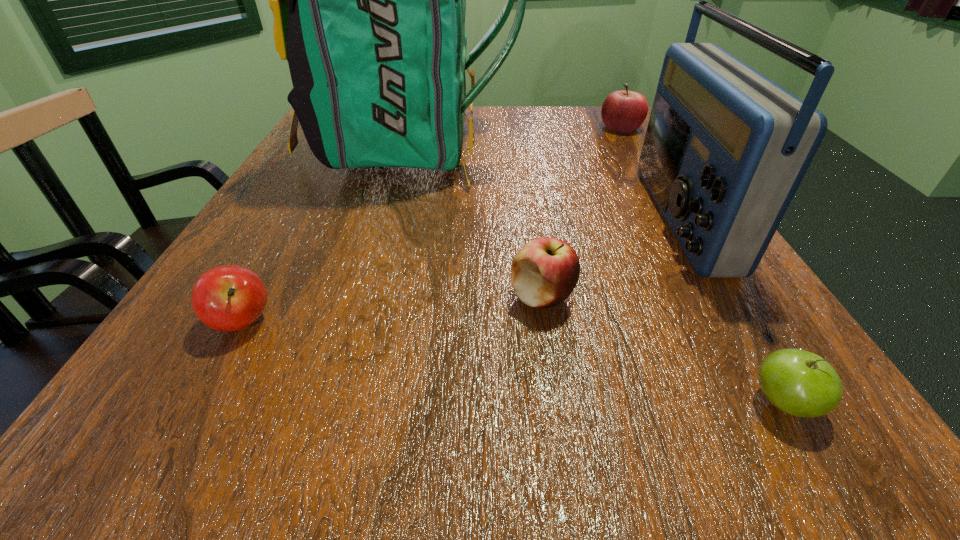
You are a GUI agent. You are given a task and a screenshot of the screen. Output one action in this format:
    pyautogui.click(x=<x>, y=<y>)
    Task: Click on the tallest object
    
    Given the screenshot: What is the action you would take?
    pyautogui.click(x=369, y=0)

This screenshot has width=960, height=540. I want to click on radio receiver, so click(726, 148).

The image size is (960, 540). Identify the location of the farthest apple. (624, 111).

Identify the location of the second apple from left to right. (544, 272).

Identify the location of the leftmost apple. The image size is (960, 540). (227, 298).

Where is `the nearest object`? the nearest object is located at coordinates (800, 383).

Where is `vacant area situated on the back of the tallest object`? Image resolution: width=960 pixels, height=540 pixels. vacant area situated on the back of the tallest object is located at coordinates (619, 145).

This screenshot has height=540, width=960. In order to click on vacant point located on the front panel of the second tallest object in this screenshot , I will do `click(623, 217)`.

The width and height of the screenshot is (960, 540). I want to click on free space located 0.390m on the front panel of the second tallest object, so click(x=431, y=217).

At what (x,y) coordinates should I click in order to perform the action: click on free space located 0.280m on the front panel of the second tallest object. Please return your answer as a coordinate pair (x, y). The image size is (960, 540). Looking at the image, I should click on (493, 217).